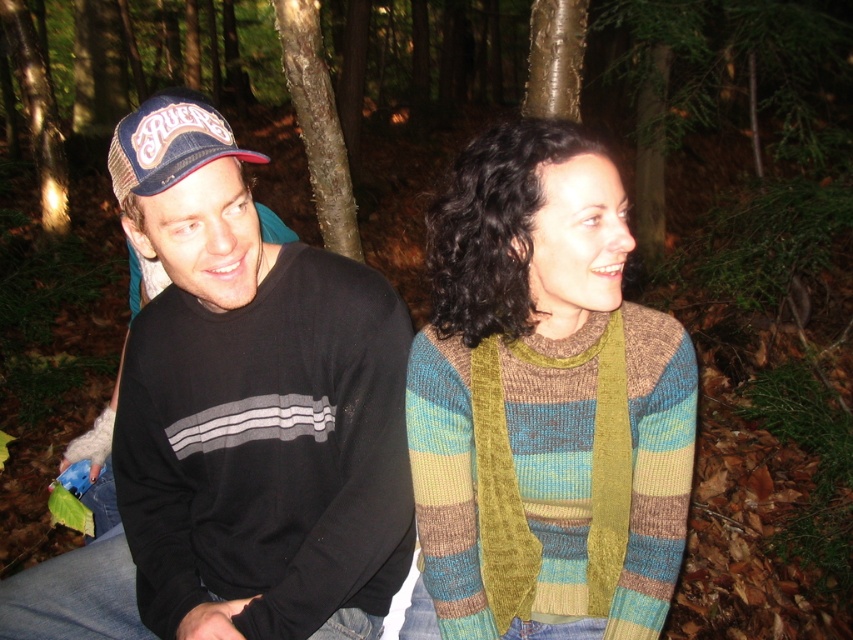
You are a photographer trying to capture a photo of both the black cotton sweatshirt at left and the knitted wool sweater at center. Since you want to ensure both are visible in the frame, which one should you focus on first to make sure it is in focus?

The black cotton sweatshirt at left is above the knitted wool sweater at center, so you should focus on the black cotton sweatshirt at left first to ensure it is in focus before adjusting for the lower one.

You are standing in a forest and see the knitted wool sweater at center. If you want to pick it up, will you need to move closer than 1 meter?

The knitted wool sweater at center is 1.01 meters away from the viewer, so you need to move closer than 1 meter to reach it.